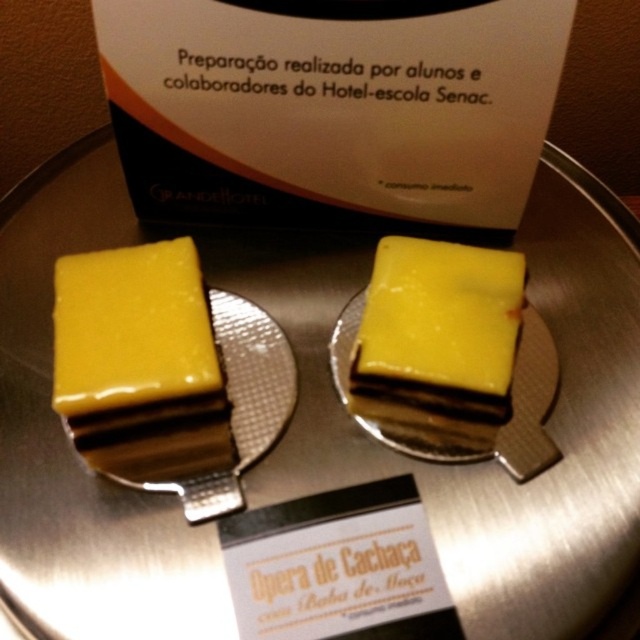
You are a customer at a bakery and see two yellow glossy cake at left and yellow glossy cake at center. Which cake is closer to you?

The yellow glossy cake at left is closer to you because it is in front of the yellow glossy cake at center.

You are a customer at a bakery and see two yellow glossy cake at left and yellow glossy cake at center. Which one is bigger?

The yellow glossy cake at center is bigger than the yellow glossy cake at left.